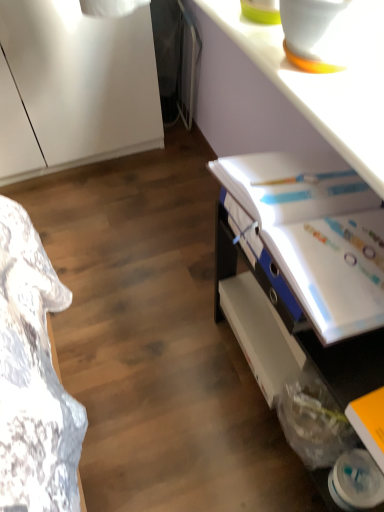
Question: Considering the positions of yellow matte book at lower right, which appears as the 1th book when viewed from the front, and white glossy binder at upper right, marked as the second book in a bottom-to-top arrangement, in the image, is yellow matte book at lower right, which appears as the 1th book when viewed from the front, taller or shorter than white glossy binder at upper right, marked as the second book in a bottom-to-top arrangement,?

Choices:
 (A) short
 (B) tall

Answer: (A)

Question: Considering the positions of yellow matte book at lower right, placed as the second book when sorted from back to front, and white glossy binder at upper right, marked as the second book in a bottom-to-top arrangement, in the image, is yellow matte book at lower right, placed as the second book when sorted from back to front, bigger or smaller than white glossy binder at upper right, marked as the second book in a bottom-to-top arrangement,?

Choices:
 (A) small
 (B) big

Answer: (A)

Question: Which object is positioned closest to the white glossy desk at lower right?

Choices:
 (A) yellow matte book at lower right, placed as the second book when sorted from back to front
 (B) white glossy binder at upper right, arranged as the first book when viewed from the back
 (C) white plastic shelf at lower right
 (D) white glossy counter top at upper right

Answer: (B)

Question: Which object is the farthest from the white glossy counter top at upper right?

Choices:
 (A) white glossy binder at upper right, marked as the second book in a bottom-to-top arrangement
 (B) white plastic shelf at lower right
 (C) yellow matte book at lower right, placed as the second book when sorted from top to bottom
 (D) white glossy desk at lower right

Answer: (C)